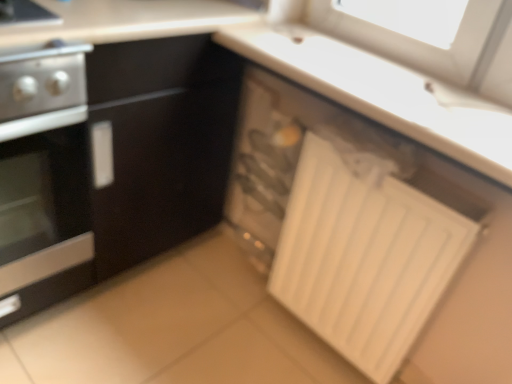
Question: Is stainless steel oven at left taller or shorter than white plastic drawer at lower right?

Choices:
 (A) short
 (B) tall

Answer: (B)

Question: From a real-world perspective, is stainless steel oven at left above or below white plastic drawer at lower right?

Choices:
 (A) above
 (B) below

Answer: (A)

Question: Estimate the real-world distances between objects in this image. Which object is closer to the stainless steel oven at left?

Choices:
 (A) white plastic drawer at lower right
 (B) white matte radiator at lower right

Answer: (A)

Question: Considering the real-world distances, which object is closest to the white matte radiator at lower right?

Choices:
 (A) stainless steel oven at left
 (B) white plastic drawer at lower right

Answer: (B)